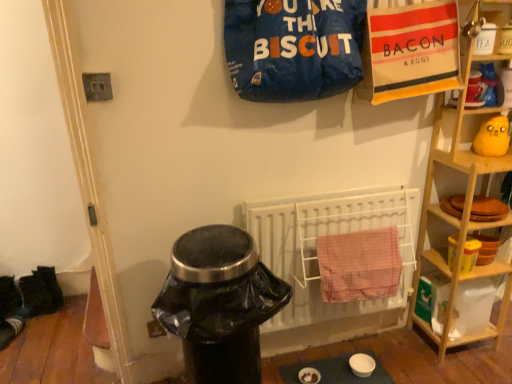
Question: Considering the positions of point (281, 16) and point (420, 230), is point (281, 16) closer or farther from the camera than point (420, 230)?

Choices:
 (A) farther
 (B) closer

Answer: (B)

Question: Considering the positions of blue fabric sack at upper center and wooden shelf at right in the image, is blue fabric sack at upper center bigger or smaller than wooden shelf at right?

Choices:
 (A) big
 (B) small

Answer: (B)

Question: Estimate the real-world distances between objects in this image. Which object is closer to the white metal radiator at center?

Choices:
 (A) wooden shelf at right
 (B) black plastic trash can at lower center
 (C) blue fabric sack at upper center
 (D) matte blue table at lower center
 (E) pink checkered towel at center

Answer: (E)

Question: Which of these objects is positioned closest to the blue fabric sack at upper center?

Choices:
 (A) black fabric shoes at lower left, the 1th footwear when ordered from top to bottom
 (B) white fabric sock at lower left, which is counted as the second footwear, starting from the top
 (C) pink checkered towel at center
 (D) white metal radiator at center
 (E) matte blue table at lower center

Answer: (D)